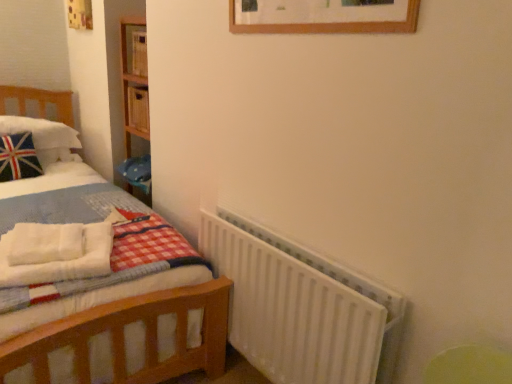
Question: Should I look upward or downward to see white plush pillow at left?

Choices:
 (A) down
 (B) up

Answer: (B)

Question: Is white fluffy blanket at left at the right side of white plush pillow at left?

Choices:
 (A) no
 (B) yes

Answer: (B)

Question: Is white plush pillow at left at the back of white fluffy blanket at left?

Choices:
 (A) no
 (B) yes

Answer: (B)

Question: Is white fluffy blanket at left beside white plush pillow at left?

Choices:
 (A) no
 (B) yes

Answer: (A)

Question: Would you consider white fluffy blanket at left to be distant from white plush pillow at left?

Choices:
 (A) no
 (B) yes

Answer: (B)

Question: Is white fluffy blanket at left completely or partially outside of white plush pillow at left?

Choices:
 (A) yes
 (B) no

Answer: (A)

Question: Considering the relative sizes of white fluffy blanket at left and white plush pillow at left in the image provided, is white fluffy blanket at left bigger than white plush pillow at left?

Choices:
 (A) yes
 (B) no

Answer: (B)

Question: Is white fluffy blanket at left inside white plush pillow at left?

Choices:
 (A) yes
 (B) no

Answer: (B)

Question: From a real-world perspective, does white plush pillow at left stand above white fluffy blanket at left?

Choices:
 (A) no
 (B) yes

Answer: (B)

Question: Does white plush pillow at left appear on the right side of white fluffy blanket at left?

Choices:
 (A) yes
 (B) no

Answer: (B)

Question: Is white plush pillow at left closer to the viewer compared to white fluffy blanket at left?

Choices:
 (A) yes
 (B) no

Answer: (B)

Question: Does white plush pillow at left appear on the left side of white fluffy blanket at left?

Choices:
 (A) yes
 (B) no

Answer: (A)

Question: Considering the relative sizes of white plush pillow at left and white fluffy blanket at left in the image provided, is white plush pillow at left thinner than white fluffy blanket at left?

Choices:
 (A) yes
 (B) no

Answer: (B)

Question: Is white matte radiator at lower right taller than white fluffy blanket at left?

Choices:
 (A) no
 (B) yes

Answer: (B)